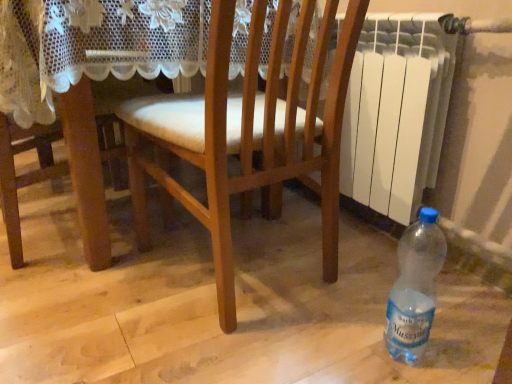
The width and height of the screenshot is (512, 384). What do you see at coordinates (249, 135) in the screenshot?
I see `wooden chair at center` at bounding box center [249, 135].

This screenshot has width=512, height=384. What are the coordinates of `translucent plastic bottle at lower right` in the screenshot? It's located at (415, 287).

Considering the positions of objects wooden chair at center and translucent plastic bottle at lower right in the image provided, who is behind, wooden chair at center or translucent plastic bottle at lower right?

Positioned behind is translucent plastic bottle at lower right.

Which is further, [161,112] or [410,257]?

The point [161,112] is farther from the camera.

Which of these two, wooden chair at center or translucent plastic bottle at lower right, is thinner?

translucent plastic bottle at lower right.

Can you confirm if wooden chair at center is taller than translucent plastic bottle at lower right?

Indeed, wooden chair at center has a greater height compared to translucent plastic bottle at lower right.

Is white plastic radiator at right smaller than wooden chair at center?

Yes, white plastic radiator at right is smaller than wooden chair at center.

Is point (429, 81) behind point (193, 116)?

That is True.

Does white plastic radiator at right have a greater height compared to wooden chair at center?

In fact, white plastic radiator at right may be shorter than wooden chair at center.

Is white plastic radiator at right closer to camera compared to wooden chair at center?

No.

How many degrees apart are the facing directions of translucent plastic bottle at lower right and white plastic radiator at right?

They differ by 1.57 degrees in their facing directions.

From a real-world perspective, is translucent plastic bottle at lower right above or below white plastic radiator at right?

From a real-world perspective, translucent plastic bottle at lower right is physically below white plastic radiator at right.

Considering the positions of objects translucent plastic bottle at lower right and white plastic radiator at right in the image provided, who is more to the right, translucent plastic bottle at lower right or white plastic radiator at right?

Positioned to the right is white plastic radiator at right.

From the image's perspective, does translucent plastic bottle at lower right appear higher than white plastic radiator at right?

No, from the image's perspective, translucent plastic bottle at lower right is not on top of white plastic radiator at right.

From the image's perspective, which is above, translucent plastic bottle at lower right or wooden chair at center?

wooden chair at center is shown above in the image.

Considering the relative positions of translucent plastic bottle at lower right and wooden chair at center in the image provided, is translucent plastic bottle at lower right to the right of wooden chair at center from the viewer's perspective?

Yes.

Considering the points (410, 357) and (261, 132), which point is in front, point (410, 357) or point (261, 132)?

Positioned in front is point (410, 357).

Would you say wooden chair at center is part of translucent plastic bottle at lower right's contents?

No, wooden chair at center is located outside of translucent plastic bottle at lower right.

From a real-world perspective, between white plastic radiator at right and translucent plastic bottle at lower right, who is vertically higher?

white plastic radiator at right.

Between white plastic radiator at right and translucent plastic bottle at lower right, which one is positioned behind?

white plastic radiator at right is behind.

Does white plastic radiator at right turn towards translucent plastic bottle at lower right?

No, white plastic radiator at right is not oriented towards translucent plastic bottle at lower right.

What's the angular difference between white plastic radiator at right and translucent plastic bottle at lower right's facing directions?

1.57 degrees.

Is wooden chair at center looking in the opposite direction of white plastic radiator at right?

wooden chair at center is not turned away from white plastic radiator at right.

Looking at this image, from a real-world perspective, which object stands above the other?

white plastic radiator at right is physically above.

Considering the relative sizes of wooden chair at center and white plastic radiator at right in the image provided, is wooden chair at center smaller than white plastic radiator at right?

Actually, wooden chair at center might be larger than white plastic radiator at right.

At what (x,y) coordinates should I click in order to perform the action: click on chair below the white plastic radiator at right (from the image's perspective). Please return your answer as a coordinate pair (x, y). Image resolution: width=512 pixels, height=384 pixels. Looking at the image, I should click on (249, 135).

This screenshot has width=512, height=384. What are the coordinates of `bottle below the wooden chair at center (from a real-world perspective)` in the screenshot? It's located at (415, 287).

Identify the location of chair in front of the white plastic radiator at right. The image size is (512, 384). (249, 135).

From the image, which object appears to be farther from wooden chair at center, white plastic radiator at right or translucent plastic bottle at lower right?

translucent plastic bottle at lower right lies further to wooden chair at center than the other object.

Based on the photo, when comparing their distances from translucent plastic bottle at lower right, does white plastic radiator at right or wooden chair at center seem closer?

Among the two, wooden chair at center is located nearer to translucent plastic bottle at lower right.

Based on their spatial positions, is wooden chair at center or white plastic radiator at right further from translucent plastic bottle at lower right?

white plastic radiator at right.

Consider the image. When comparing their distances from white plastic radiator at right, does translucent plastic bottle at lower right or wooden chair at center seem further?

translucent plastic bottle at lower right.

Which object lies further to the anchor point white plastic radiator at right, wooden chair at center or translucent plastic bottle at lower right?

translucent plastic bottle at lower right lies further to white plastic radiator at right than the other object.

Estimate the real-world distances between objects in this image. Which object is closer to wooden chair at center, translucent plastic bottle at lower right or white plastic radiator at right?

white plastic radiator at right is closer to wooden chair at center.

The height and width of the screenshot is (384, 512). What are the coordinates of `bottle between wooden chair at center and white plastic radiator at right` in the screenshot? It's located at (415, 287).